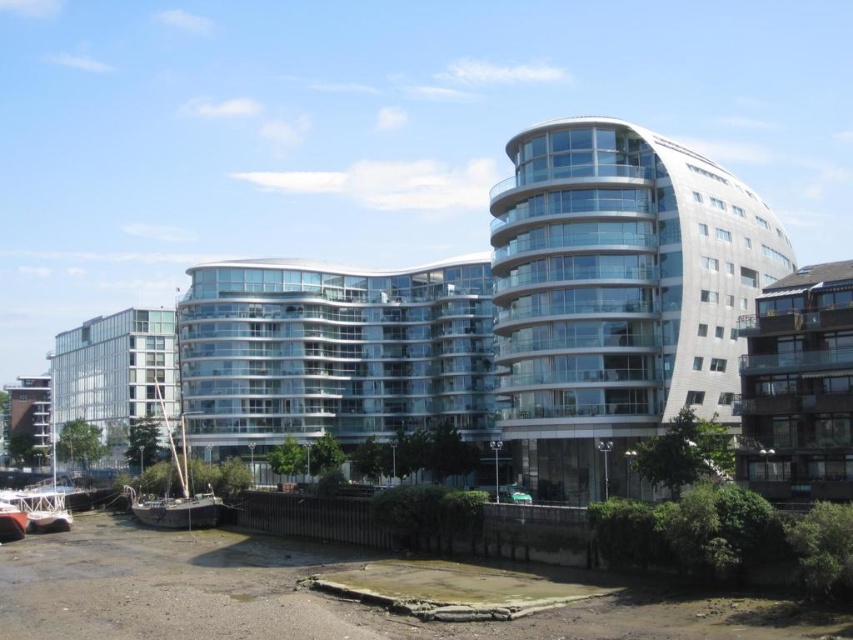
Does clear glass building at left appear over rusty wooden boat at lower left?

Yes.

Which is above, clear glass building at left or rusty wooden boat at lower left?

clear glass building at left is above.

Does point (54, 396) lie behind point (149, 508)?

Yes, point (54, 396) is behind point (149, 508).

This screenshot has width=853, height=640. What are the coordinates of `clear glass building at left` in the screenshot? It's located at (115, 376).

Which is more to the right, transparent glass building at center or brown wooden balcony at right?

brown wooden balcony at right is more to the right.

Is transparent glass building at center positioned behind brown wooden balcony at right?

That is True.

Between point (233, 368) and point (757, 483), which one is positioned in front?

Point (757, 483) is in front.

Where is `transparent glass building at center`? Image resolution: width=853 pixels, height=640 pixels. transparent glass building at center is located at coordinates (332, 353).

Who is more forward, (846, 372) or (209, 490)?

Point (846, 372)

Is point (810, 269) positioned in front of point (149, 509)?

Yes, point (810, 269) is in front of point (149, 509).

This screenshot has height=640, width=853. What are the coordinates of `brown wooden balcony at right` in the screenshot? It's located at (798, 387).

Locate an element on the screen. brown wooden balcony at right is located at coordinates (798, 387).